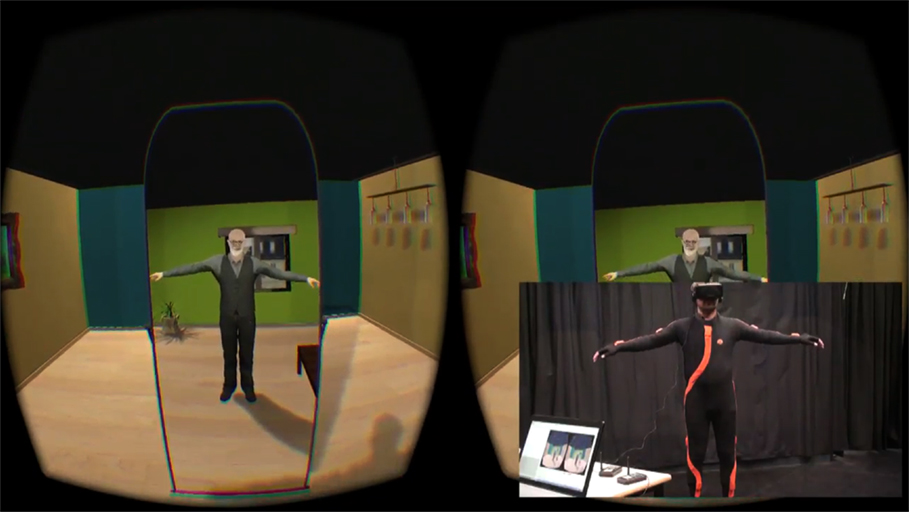
Locate an element on the screen. Image resolution: width=909 pixels, height=512 pixels. laptop screen is located at coordinates (572, 438).